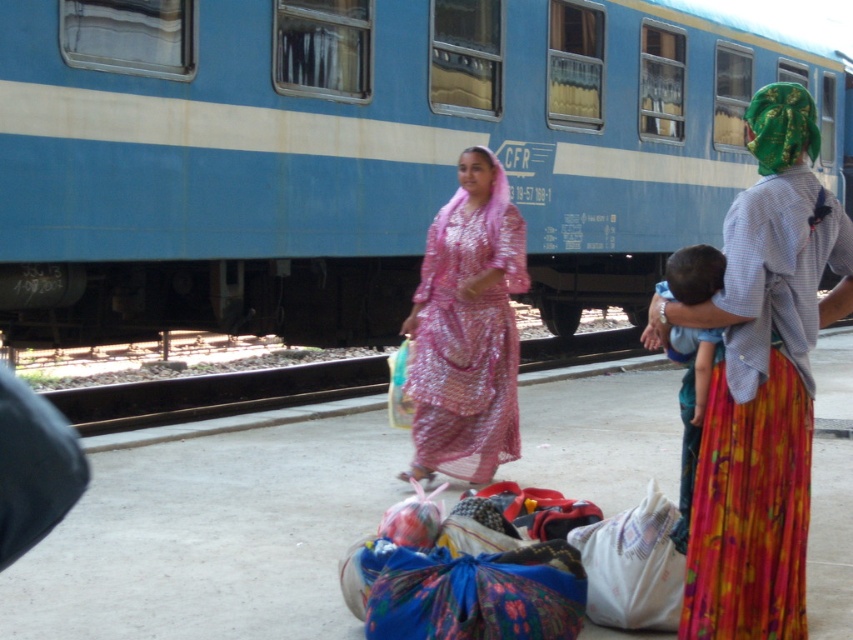
Can you confirm if blue painted train at center is positioned above pink sequined dress at center?

Yes, blue painted train at center is above pink sequined dress at center.

Based on the photo, does blue painted train at center appear on the left side of pink sequined dress at center?

No, blue painted train at center is not to the left of pink sequined dress at center.

Which is in front, point (90, 294) or point (453, 352)?

Positioned in front is point (453, 352).

In order to click on blue painted train at center in this screenshot , I will do `click(360, 154)`.